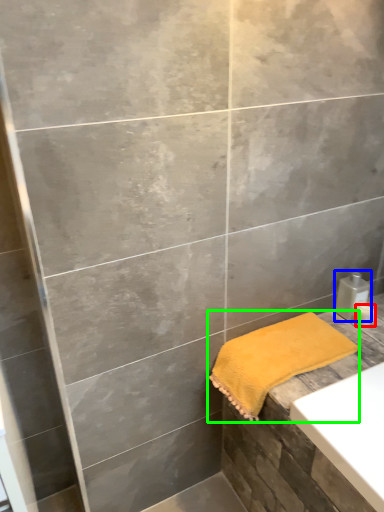
Question: Which object is positioned farthest from toiletry (highlighted by a red box)? Select from soap dispenser (highlighted by a blue box) and towel (highlighted by a green box).

Choices:
 (A) soap dispenser
 (B) towel

Answer: (B)